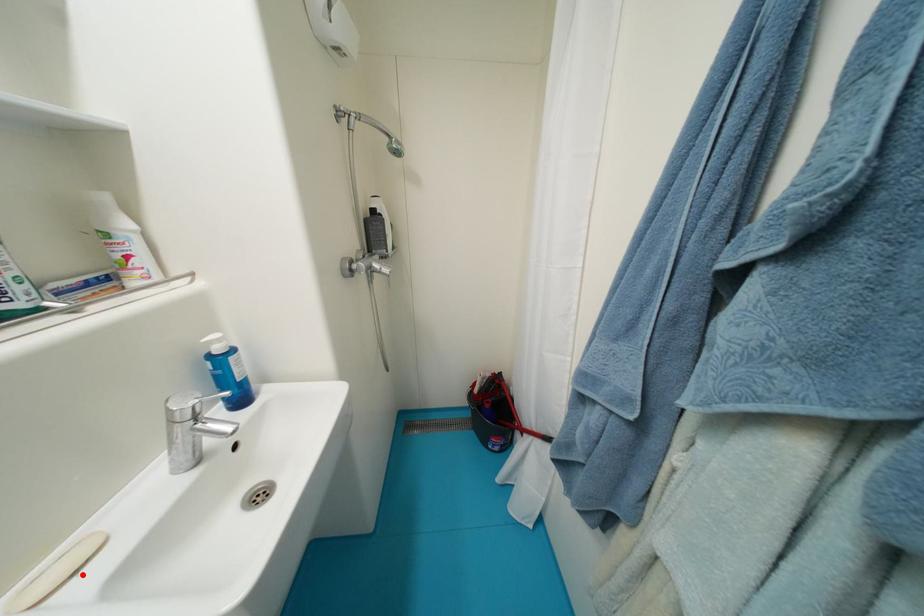
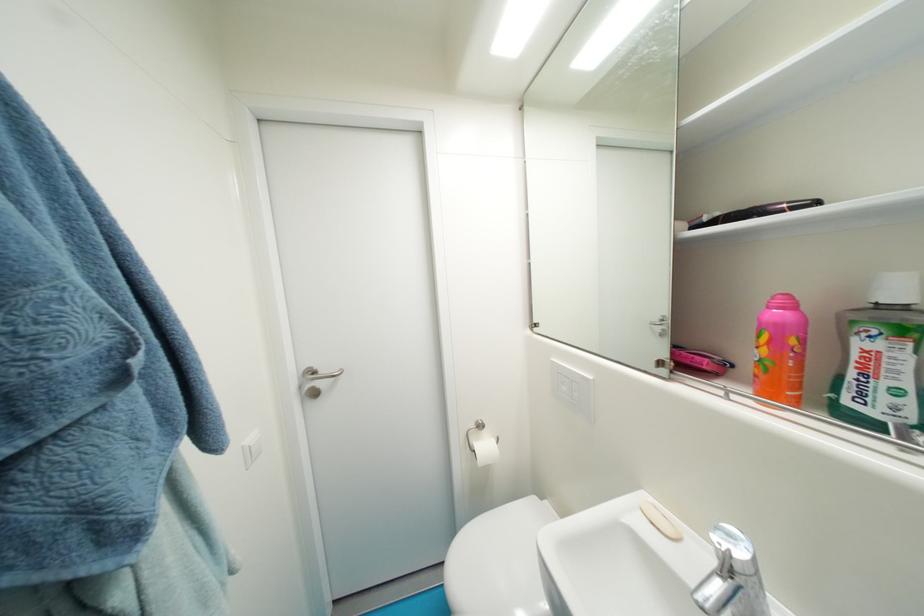
Find the pixel in the second image that matches the highlighted location in the first image.

(659, 525)